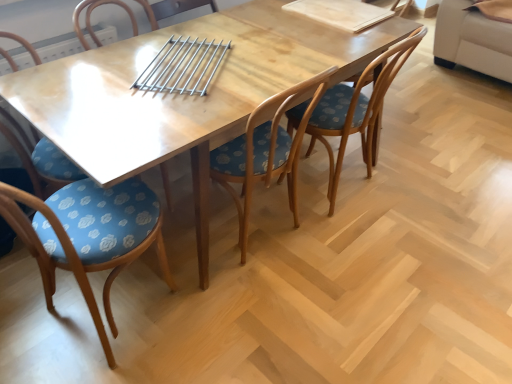
You are a GUI agent. You are given a task and a screenshot of the screen. Output one action in this format:
    pyautogui.click(x=<x>, y=<y>)
    Task: Click on the blue fabric chair at center, positioned as the 3th chair in right-to-left order
    The image size is (512, 384).
    Given the screenshot: What is the action you would take?
    pyautogui.click(x=88, y=236)

What do you see at coordinates (357, 109) in the screenshot? I see `wooden chair with floral cushion at center, acting as the 1th chair starting from the right` at bounding box center [357, 109].

How much space does wooden chair with floral cushion at center, positioned as the fourth chair in left-to-right order, occupy horizontally?

wooden chair with floral cushion at center, positioned as the fourth chair in left-to-right order, is 21.14 inches in width.

Locate an element on the screen. This screenshot has width=512, height=384. wooden chair with floral cushion at center, the second chair in the right-to-left sequence is located at coordinates (266, 149).

Is wooden chair with floral cushion at center, the second chair in the right-to-left sequence, in front of blue fabric chair at center, marked as the second chair in a left-to-right arrangement?

No, wooden chair with floral cushion at center, the second chair in the right-to-left sequence, is further to the viewer.

Could you tell me if wooden chair with floral cushion at center, acting as the third chair starting from the left, is facing blue fabric chair at center, positioned as the 3th chair in right-to-left order?

No, wooden chair with floral cushion at center, acting as the third chair starting from the left, is not facing towards blue fabric chair at center, positioned as the 3th chair in right-to-left order.

Can you tell me how much wooden chair with floral cushion at center, the second chair in the right-to-left sequence, and blue fabric chair at center, marked as the second chair in a left-to-right arrangement, differ in facing direction?

83.7 degrees.

Considering the positions of objects wooden chair with floral cushion at center, acting as the third chair starting from the left, and blue fabric chair at center, positioned as the 3th chair in right-to-left order, in the image provided, who is more to the left, wooden chair with floral cushion at center, acting as the third chair starting from the left, or blue fabric chair at center, positioned as the 3th chair in right-to-left order,?

Positioned to the left is blue fabric chair at center, positioned as the 3th chair in right-to-left order.

Is blue floral fabric chair at lower left, the 4th chair positioned from the right, spatially inside blue fabric chair at center, marked as the second chair in a left-to-right arrangement, or outside of it?

blue floral fabric chair at lower left, the 4th chair positioned from the right, is not enclosed by blue fabric chair at center, marked as the second chair in a left-to-right arrangement.

Which object is more forward, blue floral fabric chair at lower left, the 4th chair positioned from the right, or blue fabric chair at center, marked as the second chair in a left-to-right arrangement?

blue fabric chair at center, marked as the second chair in a left-to-right arrangement.

Who is taller, blue floral fabric chair at lower left, which is the 1th chair from left to right, or blue fabric chair at center, marked as the second chair in a left-to-right arrangement?

With more height is blue fabric chair at center, marked as the second chair in a left-to-right arrangement.

Is point (354, 92) closer or farther from the camera than point (276, 127)?

Point (354, 92).

From the image's perspective, is wooden chair with floral cushion at center, acting as the 1th chair starting from the right, above wooden chair with floral cushion at center, the second chair in the right-to-left sequence?

Yes.

What's the angular difference between wooden chair with floral cushion at center, positioned as the fourth chair in left-to-right order, and wooden chair with floral cushion at center, the second chair in the right-to-left sequence,'s facing directions?

5.9 degrees separate the facing orientations of wooden chair with floral cushion at center, positioned as the fourth chair in left-to-right order, and wooden chair with floral cushion at center, the second chair in the right-to-left sequence.

Can you confirm if blue fabric chair at center, positioned as the 3th chair in right-to-left order, is smaller than wooden chair with floral cushion at center, acting as the third chair starting from the left?

Correct, blue fabric chair at center, positioned as the 3th chair in right-to-left order, occupies less space than wooden chair with floral cushion at center, acting as the third chair starting from the left.

From the image's perspective, is blue fabric chair at center, marked as the second chair in a left-to-right arrangement, located beneath wooden chair with floral cushion at center, the second chair in the right-to-left sequence?

Correct, blue fabric chair at center, marked as the second chair in a left-to-right arrangement, appears lower than wooden chair with floral cushion at center, the second chair in the right-to-left sequence, in the image.

From a real-world perspective, is blue fabric chair at center, positioned as the 3th chair in right-to-left order, positioned over wooden chair with floral cushion at center, the second chair in the right-to-left sequence, based on gravity?

Actually, blue fabric chair at center, positioned as the 3th chair in right-to-left order, is physically below wooden chair with floral cushion at center, the second chair in the right-to-left sequence, in the real world.

Could you measure the distance between blue fabric chair at center, positioned as the 3th chair in right-to-left order, and wooden chair with floral cushion at center, acting as the third chair starting from the left?

20.15 inches.

How different are the orientations of wooden table at center and blue fabric chair at center, positioned as the 3th chair in right-to-left order, in degrees?

The angle between the facing direction of wooden table at center and the facing direction of blue fabric chair at center, positioned as the 3th chair in right-to-left order, is 97.4 degrees.

Is wooden table at center facing towards blue fabric chair at center, positioned as the 3th chair in right-to-left order?

No, wooden table at center does not turn towards blue fabric chair at center, positioned as the 3th chair in right-to-left order.

Is wooden table at center next to blue fabric chair at center, marked as the second chair in a left-to-right arrangement?

No, wooden table at center is not next to blue fabric chair at center, marked as the second chair in a left-to-right arrangement.

Considering the positions of point (3, 93) and point (111, 200), is point (3, 93) closer or farther from the camera than point (111, 200)?

Point (3, 93) appears to be farther away from the viewer than point (111, 200).

Is the surface of blue floral fabric chair at lower left, the 4th chair positioned from the right, in direct contact with wooden table at center?

No, blue floral fabric chair at lower left, the 4th chair positioned from the right, is not beside wooden table at center.

Is blue floral fabric chair at lower left, which is the 1th chair from left to right, positioned with its back to wooden table at center?

Correct, blue floral fabric chair at lower left, which is the 1th chair from left to right, is looking away from wooden table at center.

Which is more to the right, blue floral fabric chair at lower left, the 4th chair positioned from the right, or wooden table at center?

Positioned to the right is wooden table at center.

Can you confirm if blue floral fabric chair at lower left, the 4th chair positioned from the right, is smaller than wooden table at center?

Yes, blue floral fabric chair at lower left, the 4th chair positioned from the right, is smaller than wooden table at center.

Which object is positioned more to the left, wooden chair with floral cushion at center, the second chair in the right-to-left sequence, or wooden table at center?

Positioned to the left is wooden table at center.

In the image, there is a wooden chair with floral cushion at center, the second chair in the right-to-left sequence. At what (x,y) coordinates should I click in order to perform the action: click on table below it (from a real-world perspective). Please return your answer as a coordinate pair (x, y). The image size is (512, 384). Looking at the image, I should click on pos(182,95).

Is wooden chair with floral cushion at center, the second chair in the right-to-left sequence, oriented away from wooden table at center?

Correct, wooden chair with floral cushion at center, the second chair in the right-to-left sequence, is looking away from wooden table at center.

The height and width of the screenshot is (384, 512). Identify the location of chair in front of the wooden chair with floral cushion at center, acting as the third chair starting from the left. (88, 236).

Locate an element on the screen. This screenshot has width=512, height=384. chair below the blue floral fabric chair at lower left, which is the 1th chair from left to right (from the image's perspective) is located at coordinates (88, 236).

Based on their spatial positions, is blue fabric chair at center, marked as the second chair in a left-to-right arrangement, or wooden chair with floral cushion at center, positioned as the fourth chair in left-to-right order, closer to blue floral fabric chair at lower left, which is the 1th chair from left to right?

blue fabric chair at center, marked as the second chair in a left-to-right arrangement, is positioned closer to the anchor blue floral fabric chair at lower left, which is the 1th chair from left to right.

Looking at the image, which one is located closer to wooden chair with floral cushion at center, acting as the third chair starting from the left, wooden table at center or blue floral fabric chair at lower left, which is the 1th chair from left to right?

The object closer to wooden chair with floral cushion at center, acting as the third chair starting from the left, is wooden table at center.

When comparing their distances from blue floral fabric chair at lower left, the 4th chair positioned from the right, does blue fabric chair at center, marked as the second chair in a left-to-right arrangement, or wooden chair with floral cushion at center, the second chair in the right-to-left sequence, seem closer?

blue fabric chair at center, marked as the second chair in a left-to-right arrangement, is closer to blue floral fabric chair at lower left, the 4th chair positioned from the right.

In the scene shown: From the image, which object appears to be nearer to wooden chair with floral cushion at center, acting as the third chair starting from the left, blue fabric chair at center, marked as the second chair in a left-to-right arrangement, or wooden table at center?

wooden table at center is positioned closer to the anchor wooden chair with floral cushion at center, acting as the third chair starting from the left.

Estimate the real-world distances between objects in this image. Which object is closer to blue floral fabric chair at lower left, which is the 1th chair from left to right, wooden table at center or blue fabric chair at center, marked as the second chair in a left-to-right arrangement?

blue fabric chair at center, marked as the second chair in a left-to-right arrangement, is positioned closer to the anchor blue floral fabric chair at lower left, which is the 1th chair from left to right.

Looking at the image, which one is located closer to wooden table at center, blue floral fabric chair at lower left, which is the 1th chair from left to right, or blue fabric chair at center, marked as the second chair in a left-to-right arrangement?

blue fabric chair at center, marked as the second chair in a left-to-right arrangement, is positioned closer to the anchor wooden table at center.

Estimate the real-world distances between objects in this image. Which object is closer to blue fabric chair at center, marked as the second chair in a left-to-right arrangement, wooden table at center or wooden chair with floral cushion at center, the second chair in the right-to-left sequence?

Among the two, wooden table at center is located nearer to blue fabric chair at center, marked as the second chair in a left-to-right arrangement.

Which object lies further to the anchor point wooden table at center, wooden chair with floral cushion at center, acting as the third chair starting from the left, or blue floral fabric chair at lower left, the 4th chair positioned from the right?

Among the two, blue floral fabric chair at lower left, the 4th chair positioned from the right, is located further to wooden table at center.

Find the location of a particular element. chair between blue fabric chair at center, marked as the second chair in a left-to-right arrangement, and wooden chair with floral cushion at center, acting as the 1th chair starting from the right, from left to right is located at coordinates (266, 149).

Where is `chair situated between blue floral fabric chair at lower left, the 4th chair positioned from the right, and wooden table at center from left to right`? chair situated between blue floral fabric chair at lower left, the 4th chair positioned from the right, and wooden table at center from left to right is located at coordinates (88, 236).

Locate an element on the screen. chair between wooden table at center and wooden chair with floral cushion at center, acting as the 1th chair starting from the right, from left to right is located at coordinates [x=266, y=149].

Where is `table between blue fabric chair at center, positioned as the 3th chair in right-to-left order, and wooden chair with floral cushion at center, acting as the 1th chair starting from the right, in the horizontal direction`? table between blue fabric chair at center, positioned as the 3th chair in right-to-left order, and wooden chair with floral cushion at center, acting as the 1th chair starting from the right, in the horizontal direction is located at coordinates (182, 95).